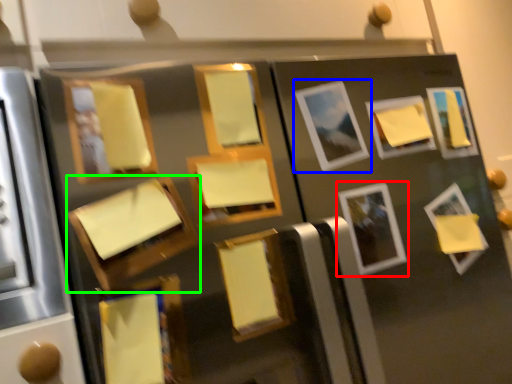
Question: Which object is the closest to the picture frame (highlighted by a red box)? Choose among these: picture frame (highlighted by a blue box) or picture frame (highlighted by a green box).

Choices:
 (A) picture frame
 (B) picture frame

Answer: (A)